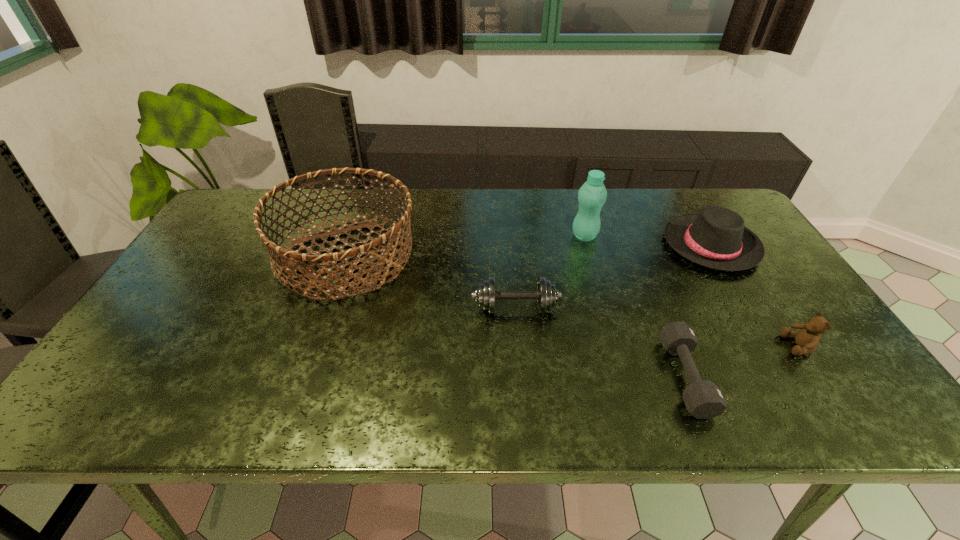
Locate an element on the screen. The height and width of the screenshot is (540, 960). empty location between the shorter dumbbell and the second tallest object is located at coordinates (516, 317).

Locate an element on the screen. empty space between the third object from left to right and the basket is located at coordinates (466, 246).

Where is `vacant area between the teddy bear and the fifth object from right to left`? The width and height of the screenshot is (960, 540). vacant area between the teddy bear and the fifth object from right to left is located at coordinates (658, 327).

Where is `empty space between the taller dumbbell and the leftmost object`? empty space between the taller dumbbell and the leftmost object is located at coordinates (431, 282).

Where is `free space between the teddy bear and the second object from left to right`? free space between the teddy bear and the second object from left to right is located at coordinates (658, 327).

Identify the location of vacant space that's between the teddy bear and the shorter dumbbell. The image size is (960, 540). (742, 361).

Locate an element on the screen. This screenshot has height=540, width=960. empty location between the fifth shortest object and the right dumbbell is located at coordinates tap(516, 317).

Where is `blank region between the basket and the bottle`? The image size is (960, 540). blank region between the basket and the bottle is located at coordinates (466, 246).

Image resolution: width=960 pixels, height=540 pixels. What are the coordinates of `free spot between the teddy bear and the fifth shortest object` in the screenshot? It's located at (572, 301).

You are a GUI agent. You are given a task and a screenshot of the screen. Output one action in this format:
    pyautogui.click(x=<x>, y=<y>)
    Task: Click on the free space that is in between the dress hat and the fourth object from left to right
    This screenshot has width=960, height=540.
    Given the screenshot: What is the action you would take?
    pyautogui.click(x=698, y=311)